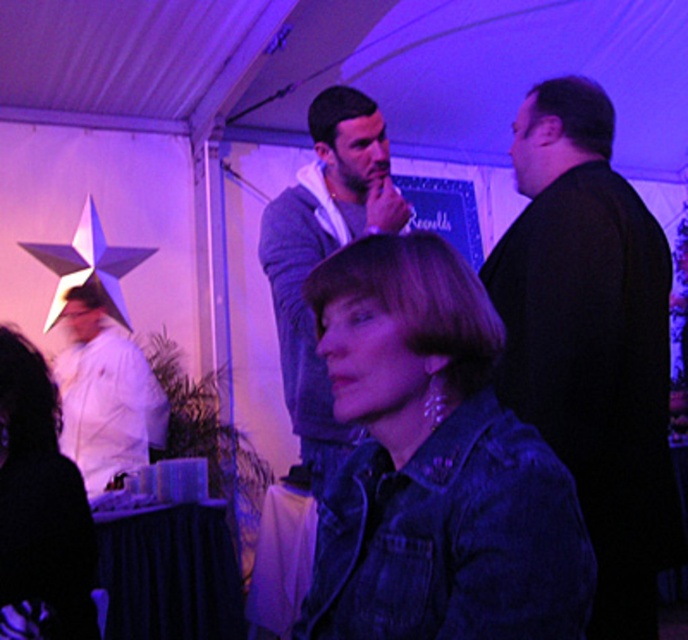
Question: Is denim jacket at lower right behind white matte chef coat at left?

Choices:
 (A) no
 (B) yes

Answer: (A)

Question: Considering the real-world distances, which object is closest to the matte white shirt at left?

Choices:
 (A) denim jacket at lower right
 (B) white matte chef coat at left

Answer: (A)

Question: Which object is the closest to the white matte chef coat at left?

Choices:
 (A) denim jacket at lower right
 (B) black matte jacket at right
 (C) knitted sweater at center

Answer: (C)

Question: From the image, what is the correct spatial relationship of matte white shirt at left in relation to white matte chef coat at left?

Choices:
 (A) below
 (B) above

Answer: (B)

Question: Which point appears closest to the camera in this image?

Choices:
 (A) (294, 300)
 (B) (568, 266)

Answer: (B)

Question: Observing the image, what is the correct spatial positioning of matte white shirt at left in reference to white matte chef coat at left?

Choices:
 (A) above
 (B) below

Answer: (A)